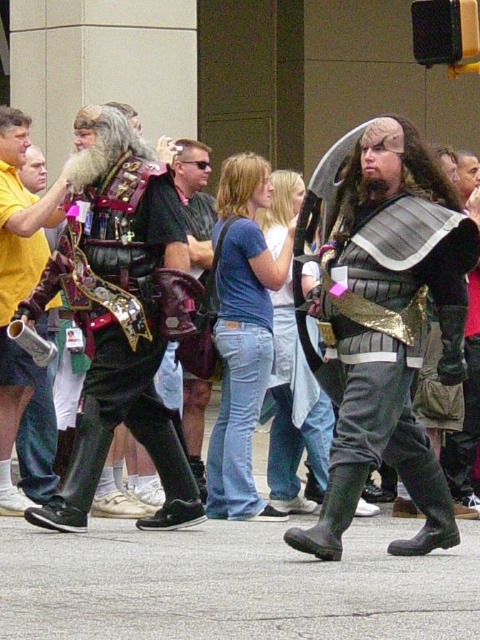
In the lively street scene, there are two costumed individuals. The first person on the left is wearing a fantasy vest with a long gray wig, and the second person is at the center wearing shiny black armor. If you were standing at the point marked as point (383,320), which costumed individual would you be closest to?

You would be closest to the second person at the center wearing shiny black armor because the point (383,320) corresponds to their location.

You are a photographer at the event and want to capture a photo that includes both the shiny metallic armor at left and the brushed metal helmet at left. Based on their positions, which object should you ensure is placed closer to the right side of the frame?

The shiny metallic armor at left should be placed closer to the right side of the frame since it is positioned to the right of the brushed metal helmet at left.